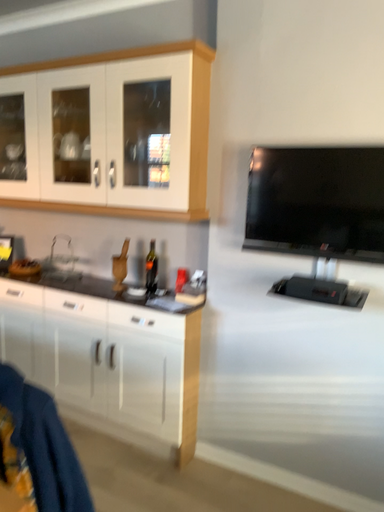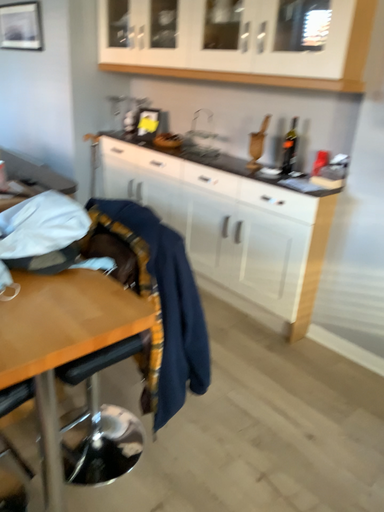
Question: How did the camera likely rotate when shooting the video?

Choices:
 (A) rotated downward
 (B) rotated upward

Answer: (A)